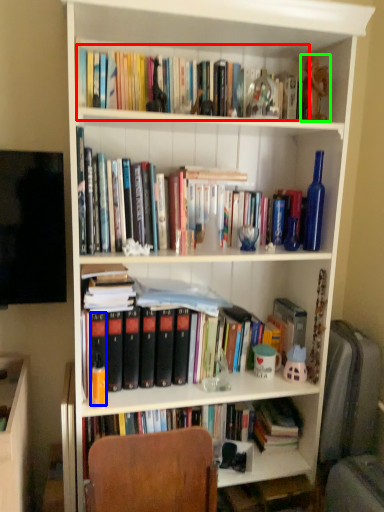
Question: Which is farther away from book (highlighted by a red box)? paperback book (highlighted by a blue box) or toy (highlighted by a green box)?

Choices:
 (A) paperback book
 (B) toy

Answer: (A)